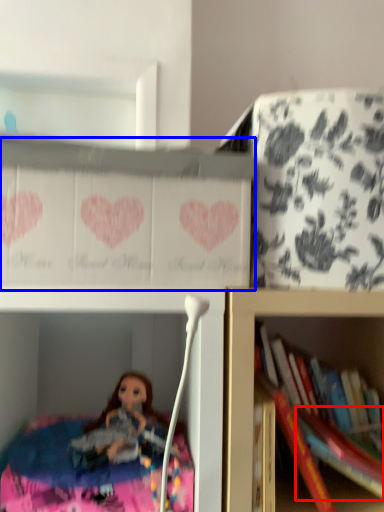
Question: Among these objects, which one is nearest to the camera, book (highlighted by a red box) or cabinet (highlighted by a blue box)?

Choices:
 (A) book
 (B) cabinet

Answer: (B)